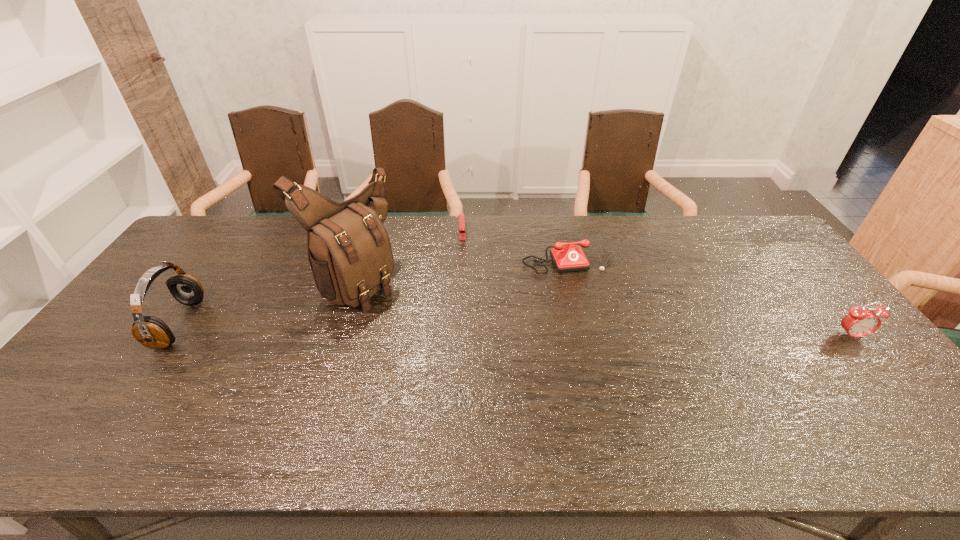
At what (x,y) coordinates should I click in order to perform the action: click on free space located 0.120m on the ear cups of the leftmost object. Please return your answer as a coordinate pair (x, y). Image resolution: width=960 pixels, height=540 pixels. Looking at the image, I should click on (120, 324).

This screenshot has height=540, width=960. What are the coordinates of `vacant area situated on the face of the alarm clock` in the screenshot? It's located at (913, 410).

Locate an element on the screen. The image size is (960, 540). vacant region located on the front-facing side of the third object from right to left is located at coordinates pyautogui.click(x=463, y=260).

The height and width of the screenshot is (540, 960). Find the location of `free space located 0.260m on the front-facing side of the third object from right to left`. free space located 0.260m on the front-facing side of the third object from right to left is located at coordinates (464, 292).

You are a GUI agent. You are given a task and a screenshot of the screen. Output one action in this format:
    pyautogui.click(x=<x>, y=<y>)
    Task: Click on the vacant region located on the front-facing side of the third object from right to left
    
    Given the screenshot: What is the action you would take?
    pyautogui.click(x=465, y=315)

The image size is (960, 540). I want to click on vacant area located on the front-facing side of the tallest object, so click(x=478, y=350).

Identify the location of free space located 0.310m on the front-facing side of the tallest object. (472, 347).

You are a GUI agent. You are given a task and a screenshot of the screen. Output one action in this format:
    pyautogui.click(x=<x>, y=<y>)
    Task: Click on the vacant area situated 0.170m on the front-facing side of the tallest object
    The image size is (960, 540).
    Given the screenshot: What is the action you would take?
    (431, 325)

Identify the location of vacant space located 0.050m on the dial of the fourth tallest object. This screenshot has height=540, width=960. (583, 286).

This screenshot has width=960, height=540. What are the coordinates of `vacant region located on the dial of the fourth tallest object` in the screenshot? It's located at (601, 324).